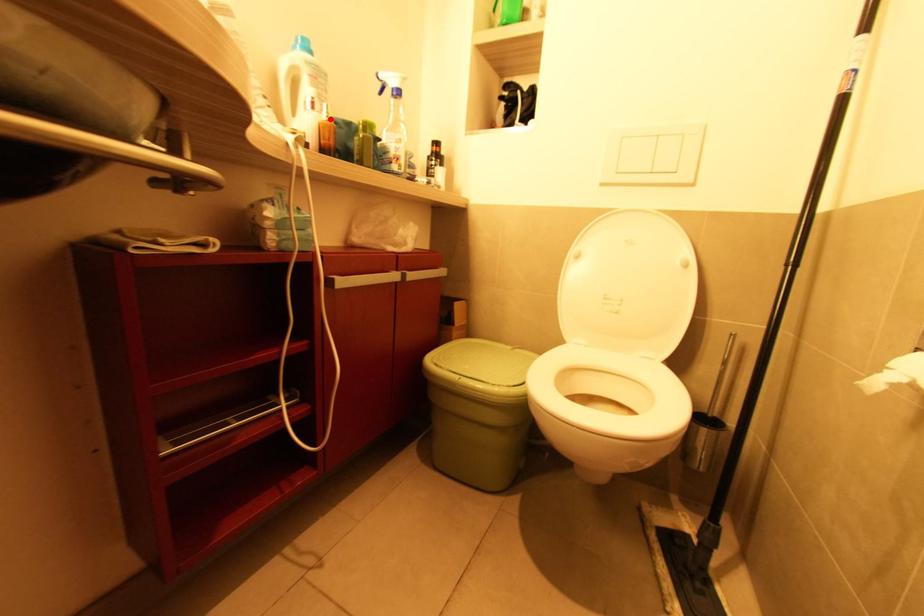
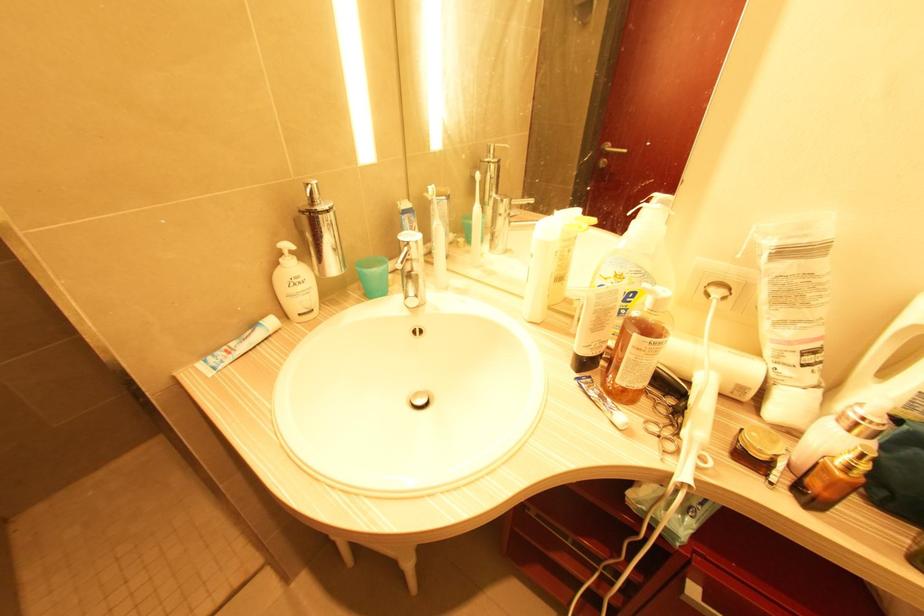
In the second image, find the point that corresponds to the highlighted location in the first image.

(850, 468)